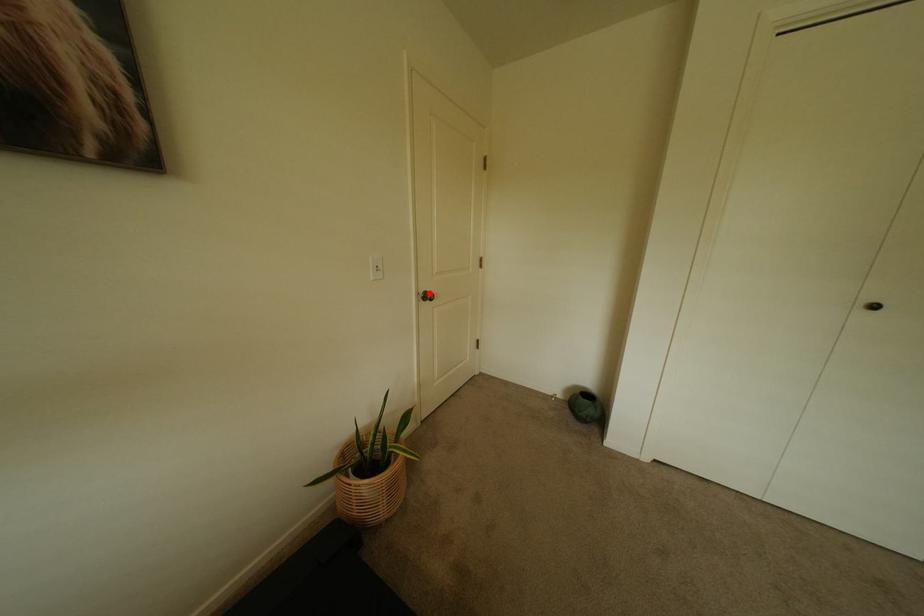
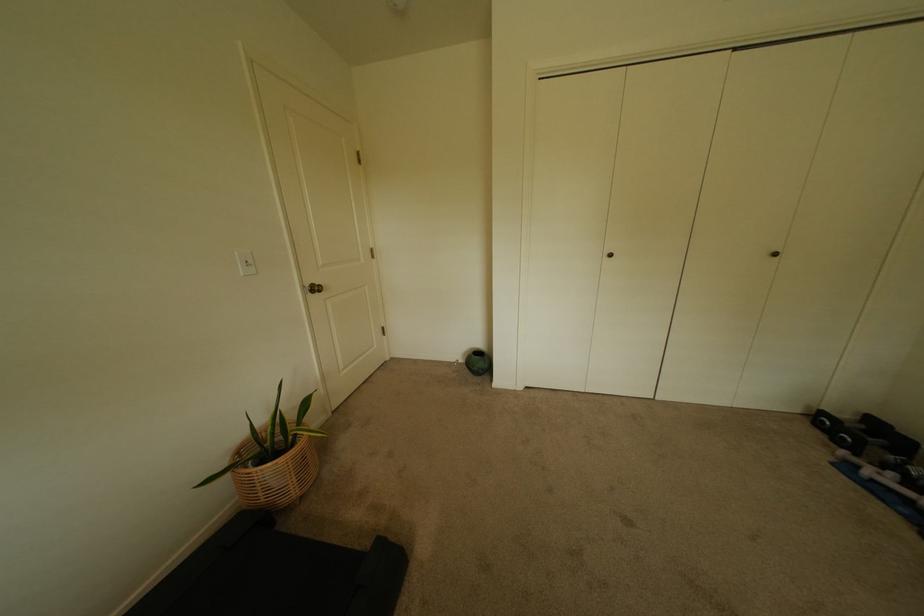
Find the pixel in the second image that matches the highlighted location in the first image.

(315, 286)